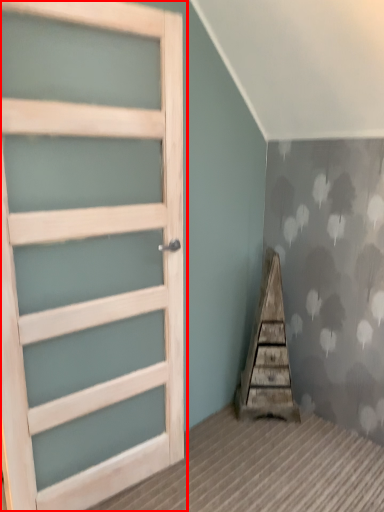
Question: Considering the relative positions of door (annotated by the red box) and stairwell in the image provided, where is door (annotated by the red box) located with respect to the staircase?

Choices:
 (A) right
 (B) left

Answer: (B)